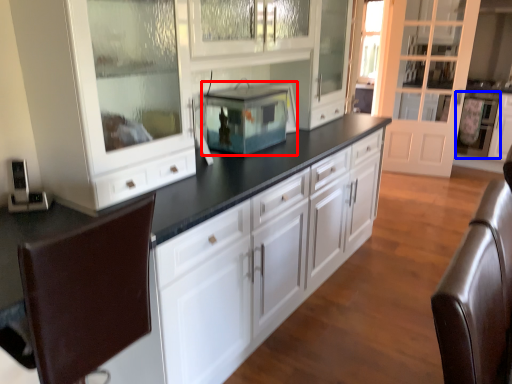
Question: Which object is closer to the camera taking this photo, home appliance (highlighted by a red box) or appliance (highlighted by a blue box)?

Choices:
 (A) home appliance
 (B) appliance

Answer: (A)